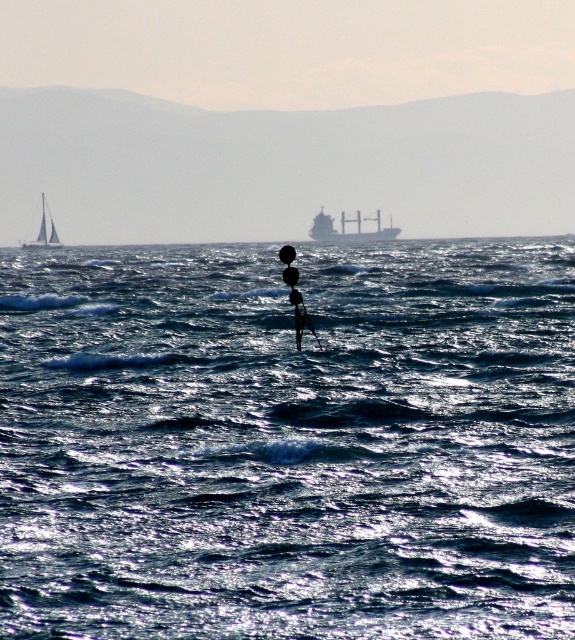
You are a sailor navigating a boat and see the point at coordinates (x=288, y=442) in the image. Where is this point located in the seascape?

The point at coordinates (x=288, y=442) is located on the shiny blue water at center.

You are a sailor navigating a small boat and need to reach the dock located at the shiny blue water at center. The white glossy sailboat at upper left is blocking your path. Can you safely navigate around it to reach your destination?

The shiny blue water at center is positioned on the right side of white glossy sailboat at upper left, so you can navigate around the white glossy sailboat at upper left by moving to its right side to reach the shiny blue water at center safely.